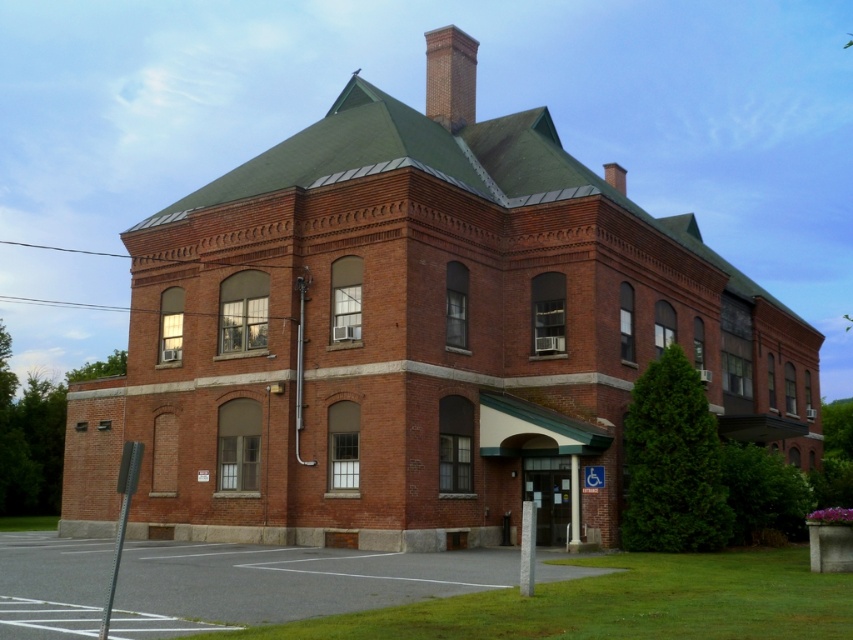
Describe the element at coordinates (120, 516) in the screenshot. I see `smooth gray pole at lower left` at that location.

Who is lower down, smooth gray pole at lower left or smooth brick chimney at upper center?

smooth gray pole at lower left is lower down.

Where is `smooth gray pole at lower left`? The image size is (853, 640). smooth gray pole at lower left is located at coordinates (120, 516).

Locate an element on the screen. The width and height of the screenshot is (853, 640). smooth gray pole at lower left is located at coordinates click(x=120, y=516).

Consider the image. Is brick chimney at upper center shorter than smooth brick chimney at upper center?

Incorrect, brick chimney at upper center's height does not fall short of smooth brick chimney at upper center's.

Is point (466, 60) positioned after point (607, 164)?

That is False.

Between point (450, 125) and point (618, 172), which one is positioned in front?

Point (450, 125) is in front.

This screenshot has width=853, height=640. In order to click on brick chimney at upper center in this screenshot , I will do `click(450, 76)`.

Which is below, brick chimney at upper center or smooth gray pole at lower left?

smooth gray pole at lower left is lower down.

Is brick chimney at upper center closer to the viewer compared to smooth gray pole at lower left?

That is False.

Is point (473, 93) less distant than point (123, 452)?

No.

You are a GUI agent. You are given a task and a screenshot of the screen. Output one action in this format:
    pyautogui.click(x=<x>, y=<y>)
    Task: Click on the brick chimney at upper center
    The width and height of the screenshot is (853, 640).
    Given the screenshot: What is the action you would take?
    pyautogui.click(x=450, y=76)